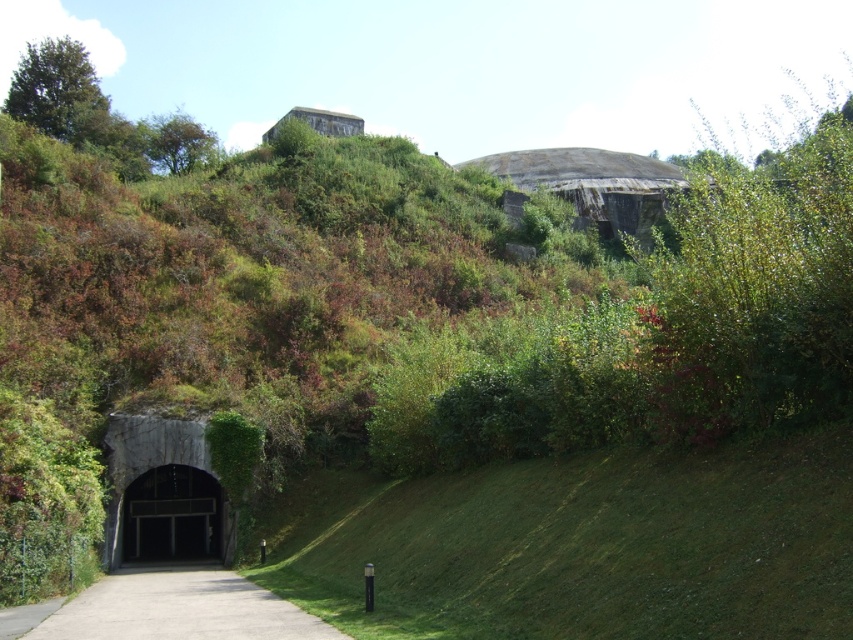
Question: Does concrete at center have a greater width compared to black concrete tunnel at lower left?

Choices:
 (A) yes
 (B) no

Answer: (A)

Question: Can you confirm if concrete at center is smaller than black concrete tunnel at lower left?

Choices:
 (A) yes
 (B) no

Answer: (B)

Question: Among these points, which one is nearest to the camera?

Choices:
 (A) (125, 545)
 (B) (166, 632)

Answer: (B)

Question: Which object appears farthest from the camera in this image?

Choices:
 (A) black concrete tunnel at lower left
 (B) gray concrete bunker at lower left
 (C) concrete at center

Answer: (A)

Question: Which object is positioned farthest from the concrete at center?

Choices:
 (A) black concrete tunnel at lower left
 (B) gray concrete bunker at lower left

Answer: (A)

Question: Can you confirm if concrete at center is positioned to the left of black concrete tunnel at lower left?

Choices:
 (A) yes
 (B) no

Answer: (B)